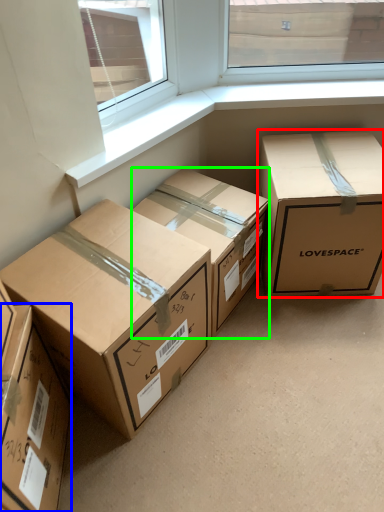
Question: Which object is the closest to the box (highlighted by a red box)? Choose among these: box (highlighted by a blue box) or box (highlighted by a green box).

Choices:
 (A) box
 (B) box

Answer: (B)